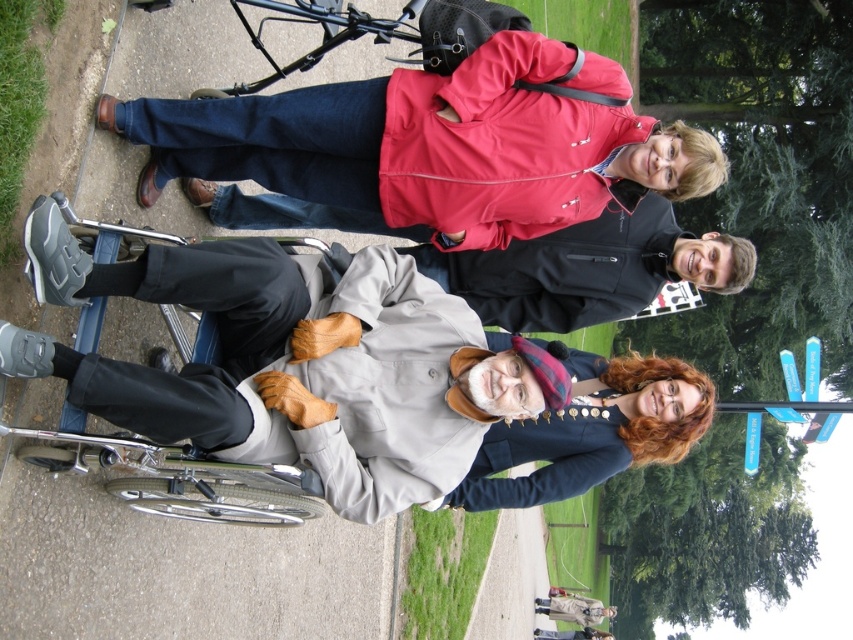
Who is lower down, light gray fabric wheelchair at center or smooth navy blue coat at lower right?

smooth navy blue coat at lower right is below.

This screenshot has height=640, width=853. Describe the element at coordinates (296, 364) in the screenshot. I see `light gray fabric wheelchair at center` at that location.

Describe the element at coordinates (296, 364) in the screenshot. Image resolution: width=853 pixels, height=640 pixels. I see `light gray fabric wheelchair at center` at that location.

At what (x,y) coordinates should I click in order to perform the action: click on light gray fabric wheelchair at center. Please return your answer as a coordinate pair (x, y). Looking at the image, I should click on (296, 364).

Is gray concrete pavement at lower left in front of smooth navy blue coat at lower right?

That is True.

Between point (78, 573) and point (573, 483), which one is positioned in front?

Positioned in front is point (78, 573).

The height and width of the screenshot is (640, 853). Find the location of `gray concrete pavement at lower left`. gray concrete pavement at lower left is located at coordinates (178, 570).

Is gray concrete pavement at lower left below matte red jacket at upper center?

Yes.

Is gray concrete pavement at lower left positioned at the back of matte red jacket at upper center?

No, gray concrete pavement at lower left is closer to the viewer.

Who is more forward, (45, 538) or (265, 120)?

Point (45, 538) is in front.

Identify the location of gray concrete pavement at lower left. This screenshot has width=853, height=640. (178, 570).